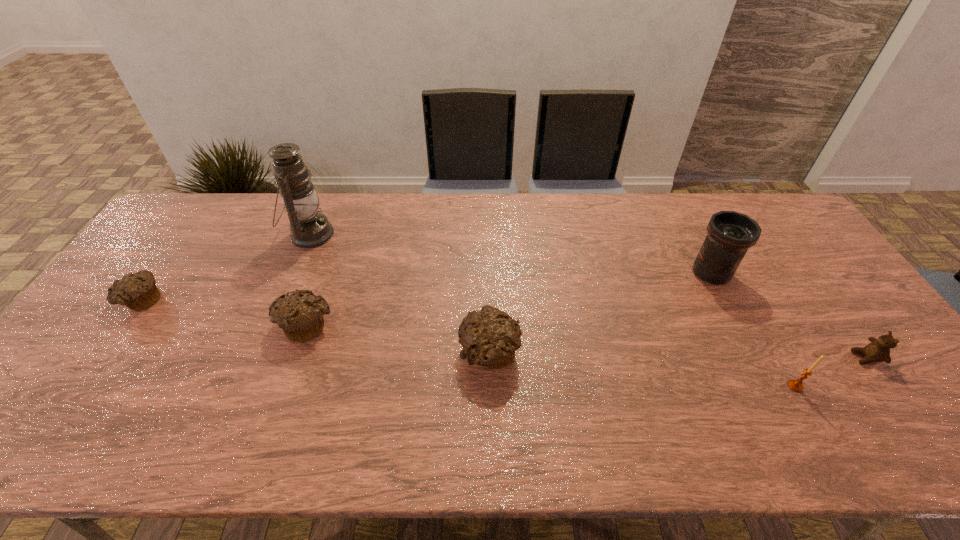
Identify the location of candle_holder present at the near edge. (796, 385).

You are a GUI agent. You are given a task and a screenshot of the screen. Output one action in this format:
    pyautogui.click(x=<x>, y=<y>)
    Task: Click on the object positioned at the left edge
    
    Given the screenshot: What is the action you would take?
    pyautogui.click(x=138, y=291)

Find the location of `object located at the right edge`. object located at the right edge is located at coordinates (878, 350).

Locate an element on the screen. free space at the far edge of the desktop is located at coordinates (411, 196).

Find the location of a particular element. This screenshot has height=540, width=960. blank space at the near edge is located at coordinates (701, 406).

Image resolution: width=960 pixels, height=540 pixels. In the image, there is a desktop. What are the coordinates of `free space at the left edge` in the screenshot? It's located at (177, 277).

You are a GUI agent. You are given a task and a screenshot of the screen. Output one action in this format:
    pyautogui.click(x=<x>, y=<y>)
    Task: Click on the blank space at the right edge of the desktop
    
    Given the screenshot: What is the action you would take?
    pyautogui.click(x=812, y=327)

Identify the location of vacant space at the far left corner. This screenshot has height=540, width=960. (191, 227).

Identify the location of free space at the near left corner. (61, 389).

The image size is (960, 540). Find the location of `vacant space at the far right corner`. vacant space at the far right corner is located at coordinates (x=790, y=222).